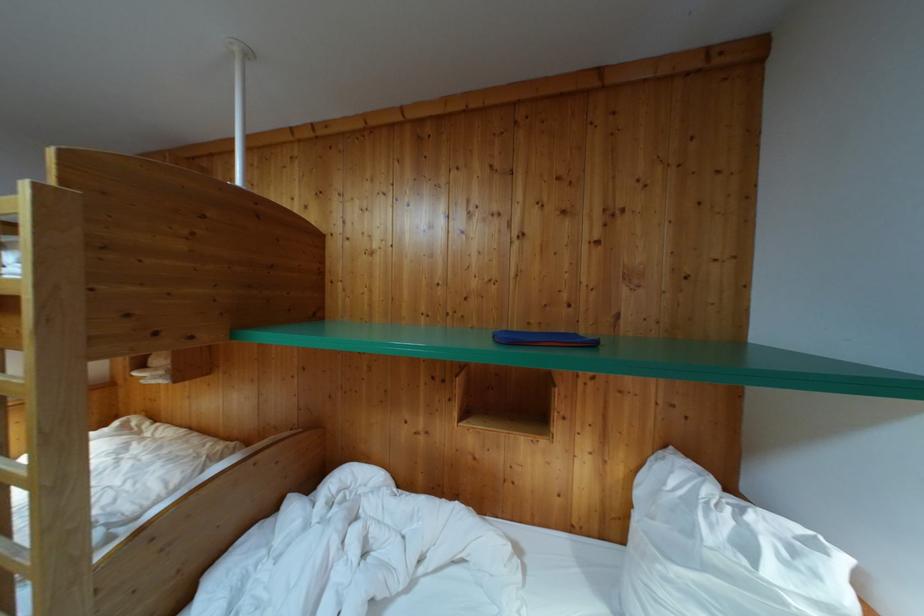
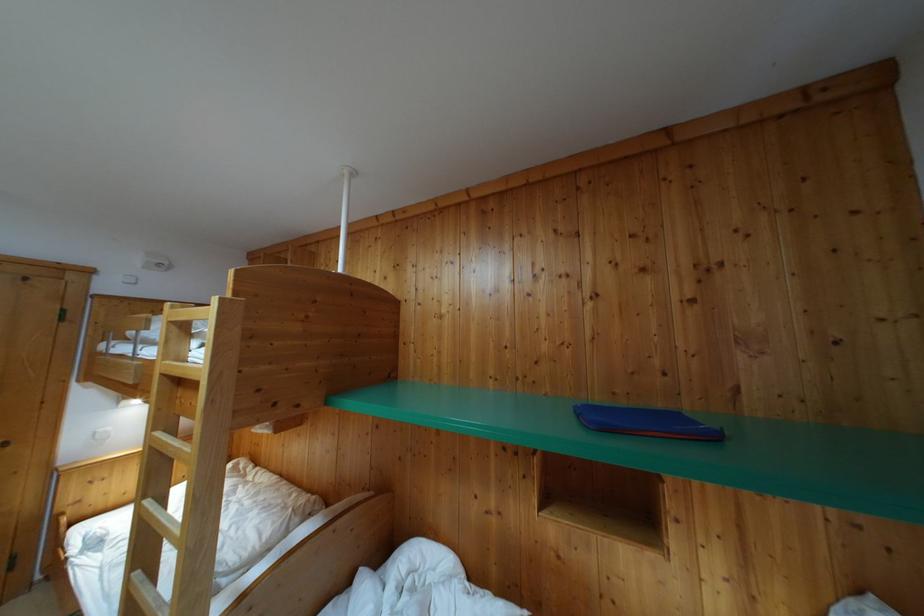
Question: Which direction would the cameraman need to move to produce the second image? Reply with the corresponding letter.

Choices:
 (A) Left
 (B) Right
 (C) Forward
 (D) Backward

Answer: (A)